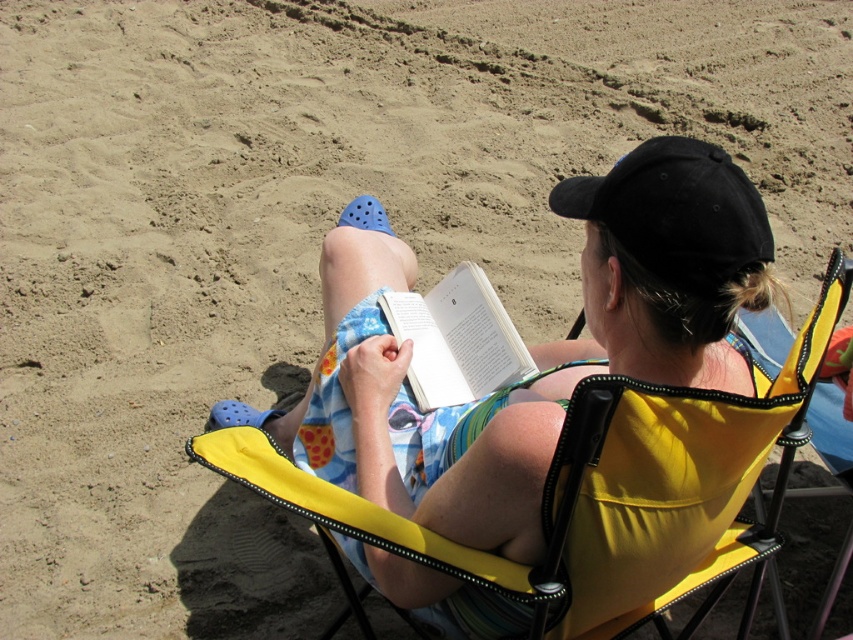
You are a photographer planning to take a portrait of the person in the image. You need to ensure that both the floral fabric dress at center and the black matte baseball cap at upper right are clearly visible in the frame. Given their sizes, which object should you focus on first to ensure both are in focus?

The floral fabric dress at center is bigger than the black matte baseball cap at upper right, so focusing on the larger object, the floral fabric dress at center, first will help ensure both are in focus since it occupies more space in the frame.

You are a photographer planning to take a picture of the floral fabric dress at center and the white paper book at center. Which object should you focus on first if you want to capture both in a single frame without moving the camera, considering their sizes?

The floral fabric dress at center has a larger size compared to the white paper book at center, so you should focus on the floral fabric dress at center first to ensure it fits well within the frame before adjusting for the smaller white paper book at center.

You are a photographer trying to capture the person in the image. You need to focus on the floral fabric dress at center and the black matte baseball cap at upper right. Which object should you adjust your camera to focus on first if you want to capture both in the same frame without moving the camera?

The floral fabric dress at center is located below the black matte baseball cap at upper right, so you should focus on the black matte baseball cap at upper right first to ensure both are in the frame.